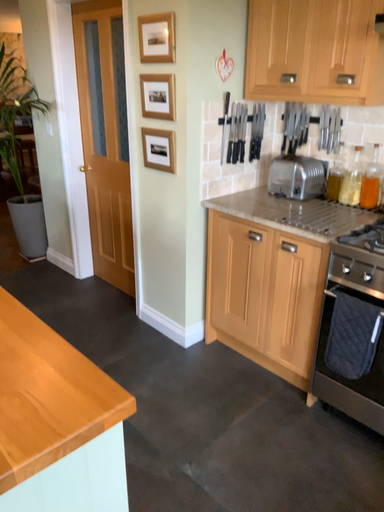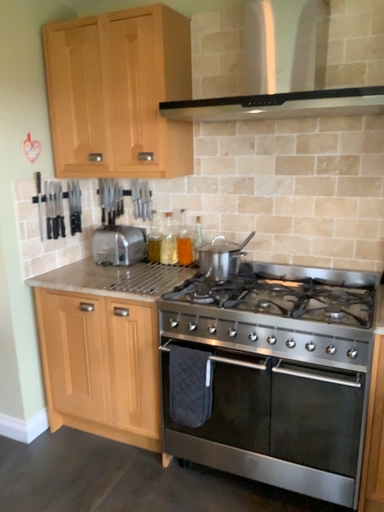
Question: How did the camera likely rotate when shooting the video?

Choices:
 (A) rotated downward
 (B) rotated upward

Answer: (B)